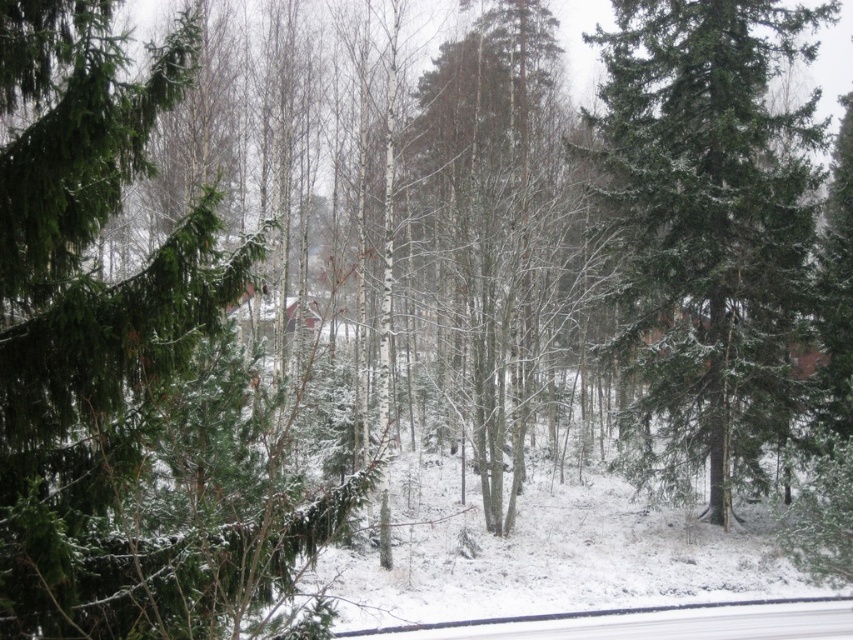
You are an observer standing in the forest looking at the green matte tree at left and the green matte tree at center. Which tree is closer to you?

The green matte tree at left is closer to you because it is in front of the green matte tree at center.

You are standing in the winter forest scene and want to locate the green matte tree at left. According to the coordinates provided, where should you look to find it?

The green matte tree at left is located at coordinates point (131, 372).

You are standing in the winter forest scene. You see a green matte tree at left and a point marked at coordinates (131, 372). Is the green matte tree at left located at that point?

Yes, the green matte tree at left is located at point (131, 372).